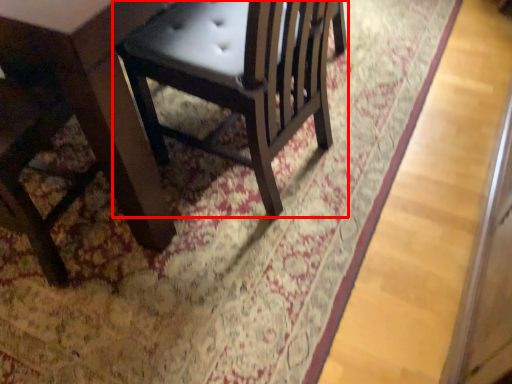
Question: Observing the image, what is the correct spatial positioning of chair (annotated by the red box) in reference to table?

Choices:
 (A) left
 (B) right

Answer: (B)